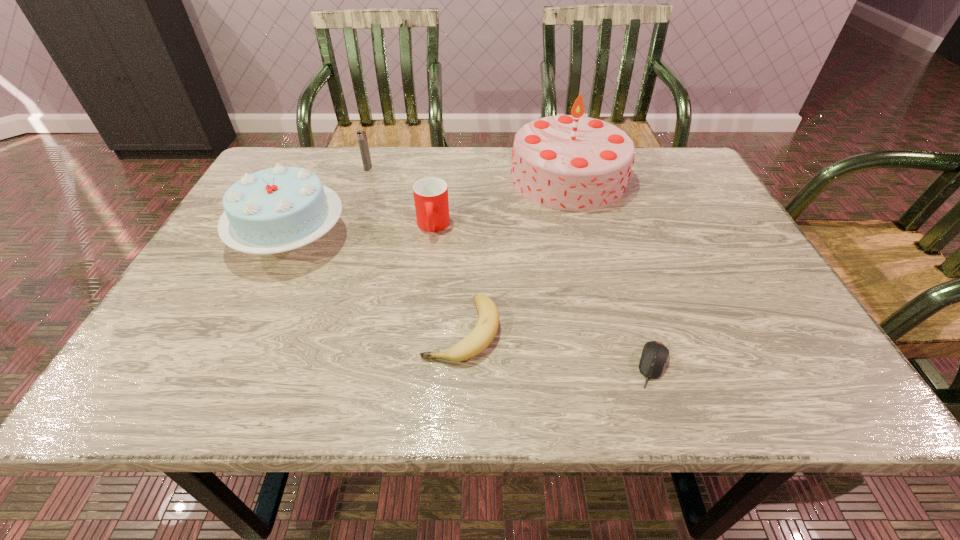
I want to click on the taller birthday cake, so click(x=571, y=162).

This screenshot has width=960, height=540. Find the location of `the right birthday cake`. the right birthday cake is located at coordinates (571, 162).

This screenshot has height=540, width=960. I want to click on the fifth shortest object, so click(279, 209).

Identify the location of the left birthday cake. (279, 209).

Where is `igniter`? Image resolution: width=960 pixels, height=540 pixels. igniter is located at coordinates (361, 135).

You are a GUI agent. You are given a task and a screenshot of the screen. Output one action in this format:
    pyautogui.click(x=<x>, y=<y>)
    Task: Click on the cup
    The image size is (960, 540).
    Given the screenshot: What is the action you would take?
    pyautogui.click(x=430, y=194)

Where is `the second shortest object`? The image size is (960, 540). the second shortest object is located at coordinates (478, 340).

The height and width of the screenshot is (540, 960). In order to click on computer mouse in this screenshot , I will do `click(654, 356)`.

What are the coordinates of `vacant space located 0.110m on the front of the tallest object` in the screenshot? It's located at (585, 241).

Where is `free space located on the right of the fifth shortest object`? The height and width of the screenshot is (540, 960). free space located on the right of the fifth shortest object is located at coordinates (437, 238).